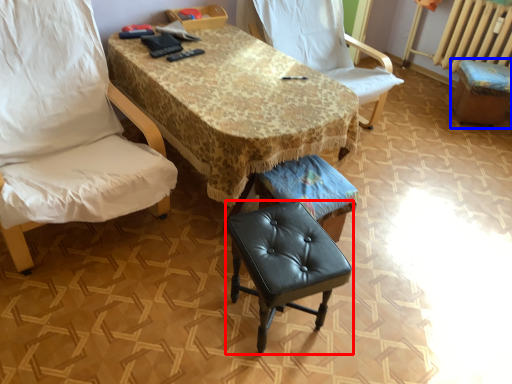
Question: Which object is closer to the camera taking this photo, stool (highlighted by a red box) or bar stool (highlighted by a blue box)?

Choices:
 (A) stool
 (B) bar stool

Answer: (A)